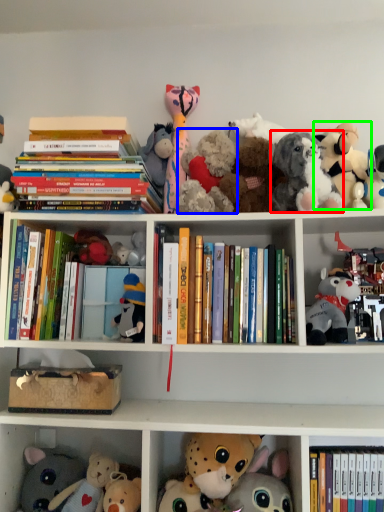
Question: Estimate the real-world distances between objects in this image. Which object is closer to toy (highlighted by a red box), toy (highlighted by a blue box) or toy (highlighted by a green box)?

Choices:
 (A) toy
 (B) toy

Answer: (B)